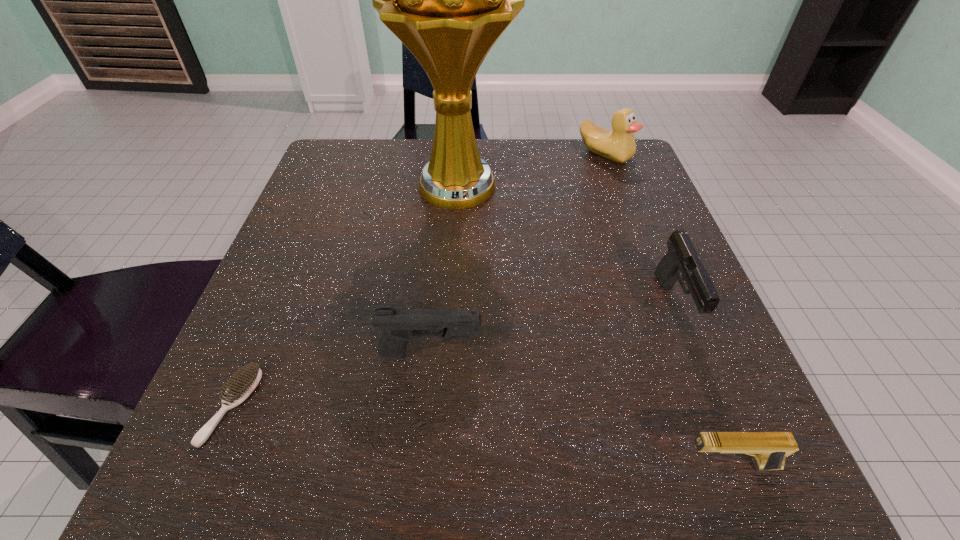
Image resolution: width=960 pixels, height=540 pixels. I want to click on empty location between the duck and the leftmost pistol, so click(x=518, y=254).

This screenshot has width=960, height=540. I want to click on free area in between the shortest pistol and the farthest pistol, so click(702, 386).

Select which object appears as the second closest to the duck. Please provide its 2D coordinates. Your answer should be formatted as a tuple, i.e. [(x, y)], where the tuple contains the x and y coordinates of a point satisfying the conditions above.

[(682, 262)]

Where is `object that is the fourth closest to the duck`? object that is the fourth closest to the duck is located at coordinates (770, 449).

Identify which pistol is located as the third nearest to the shortest object. Please provide its 2D coordinates. Your answer should be formatted as a tuple, i.e. [(x, y)], where the tuple contains the x and y coordinates of a point satisfying the conditions above.

[(682, 262)]

Locate an element on the screen. The height and width of the screenshot is (540, 960). pistol that can be found as the third closest to the duck is located at coordinates click(x=770, y=449).

Locate an element on the screen. vacant space that satisfies the following two spatial constraints: 1. aim along the barrel of the fourth nearest object; 2. at the barrel of the fourth farthest object is located at coordinates (694, 355).

Identify the location of vacant space that satisfies the following two spatial constraints: 1. at the front of the trophy_cup where the globe is prominent; 2. at the barrel of the second farthest pistol. This screenshot has height=540, width=960. (447, 355).

Where is `vacant space that satisfies the following two spatial constraints: 1. aim along the barrel of the farthest pistol; 2. at the barrel of the shortest pistol`? Image resolution: width=960 pixels, height=540 pixels. vacant space that satisfies the following two spatial constraints: 1. aim along the barrel of the farthest pistol; 2. at the barrel of the shortest pistol is located at coordinates (738, 465).

You are a GUI agent. You are given a task and a screenshot of the screen. Output one action in this format:
    pyautogui.click(x=<x>, y=<y>)
    Task: Click on the vacant space that satisfies the following two spatial constraints: 1. at the front of the trophy_cup where the globe is prominent; 2. at the barrel of the second nearest pistol
    The image size is (960, 540).
    Given the screenshot: What is the action you would take?
    pyautogui.click(x=447, y=355)